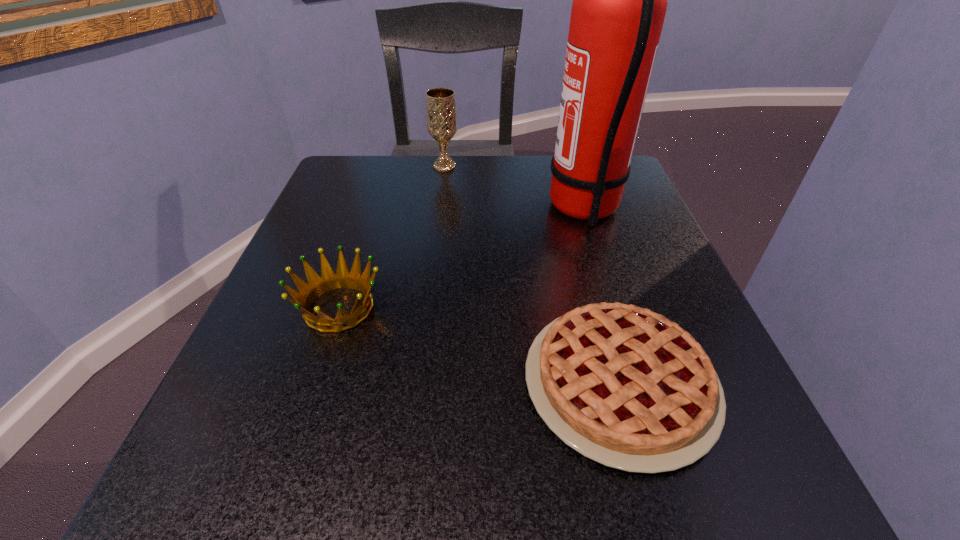
Find the location of a particular element. Image resolution: width=960 pixels, height=540 pixels. object that is at the near right corner is located at coordinates (626, 387).

This screenshot has height=540, width=960. In the image, there is a desktop. In order to click on vacant space at the far edge in this screenshot , I will do `click(420, 160)`.

Where is `vacant space at the near edge`? This screenshot has width=960, height=540. vacant space at the near edge is located at coordinates (476, 449).

Find the location of a particular element. The width and height of the screenshot is (960, 540). vacant space at the left edge is located at coordinates (348, 372).

Find the location of a particular element. The image size is (960, 540). free spot at the right edge of the desktop is located at coordinates click(724, 441).

Image resolution: width=960 pixels, height=540 pixels. Identify the location of free space at the far left corner. (340, 192).

In the image, there is a desktop. Find the location of `vacant area at the near left corner`. vacant area at the near left corner is located at coordinates (251, 478).

Image resolution: width=960 pixels, height=540 pixels. I want to click on blank space at the far right corner, so click(628, 196).

At what (x,y) coordinates should I click in order to perform the action: click on vacant space in between the third object from right to left and the pie. Please return your answer as a coordinate pair (x, y). The width and height of the screenshot is (960, 540). Looking at the image, I should click on (532, 275).

Where is `free space that is in between the second shortest object and the chalice`? The height and width of the screenshot is (540, 960). free space that is in between the second shortest object and the chalice is located at coordinates (392, 237).